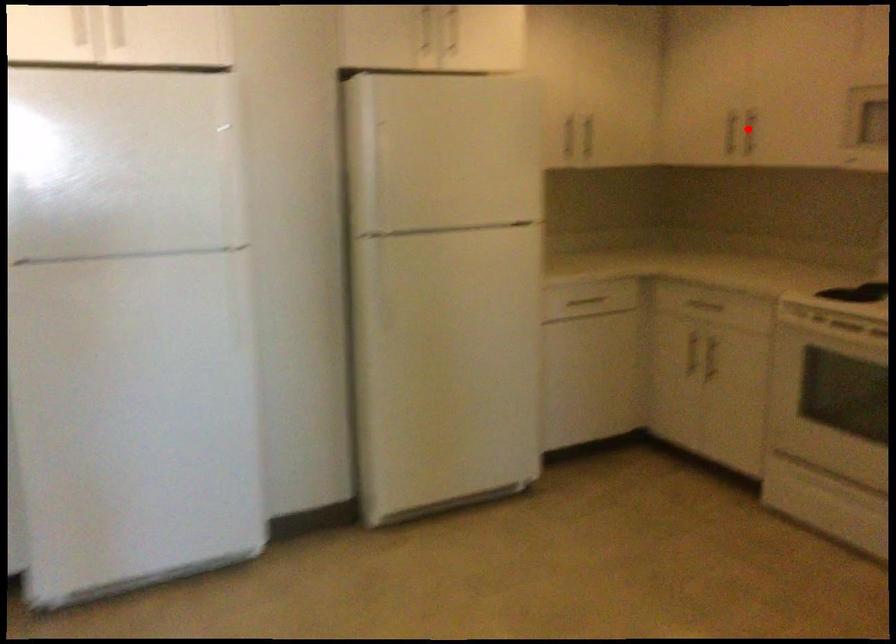
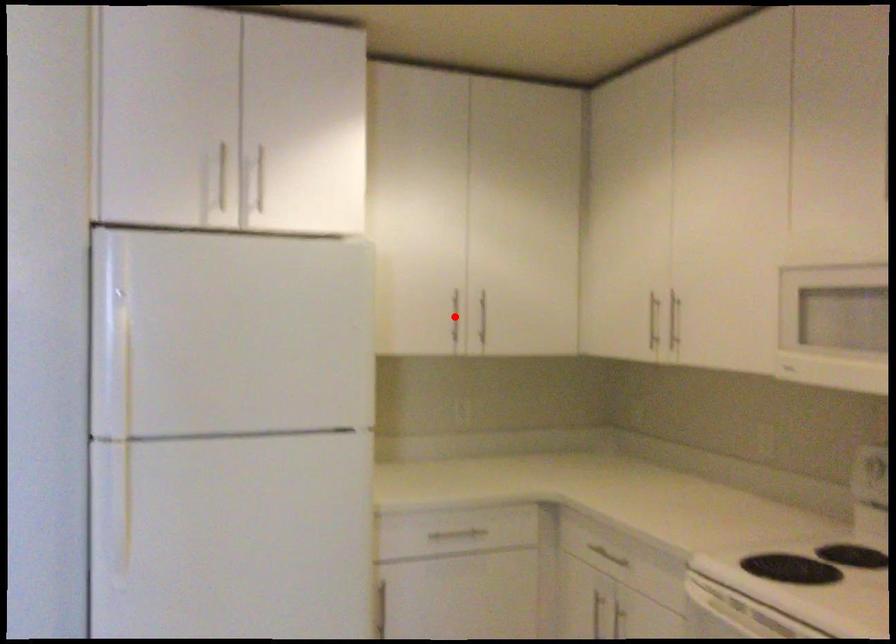
I am providing you with two images of the same scene from different viewpoints. A red point is marked on the first image and another point is marked on the second image. Is the marked point in image1 the same physical position as the marked point in image2?

No